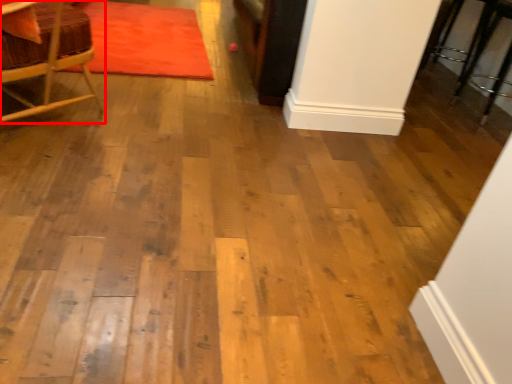
Question: In this image, where is chair (annotated by the red box) located relative to mat?

Choices:
 (A) left
 (B) right

Answer: (A)